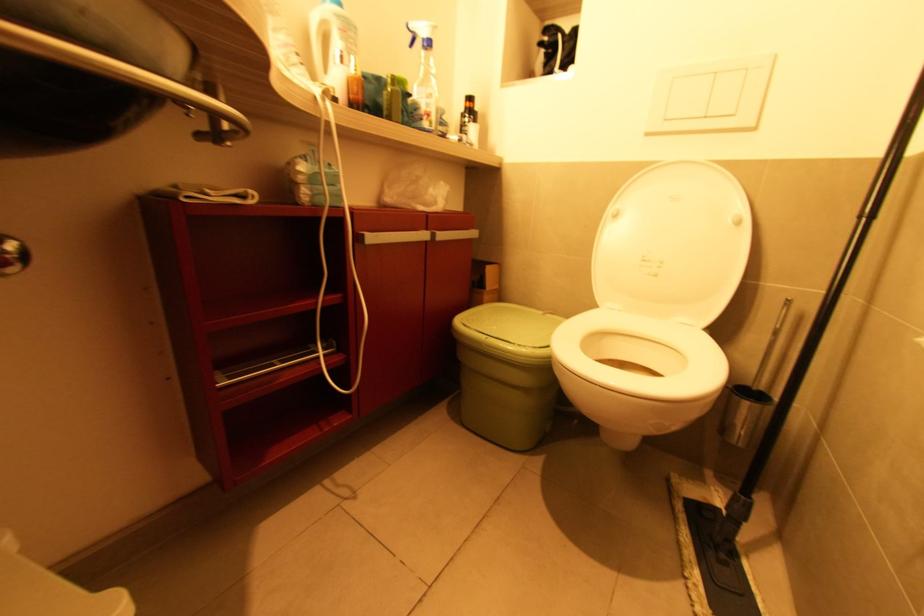
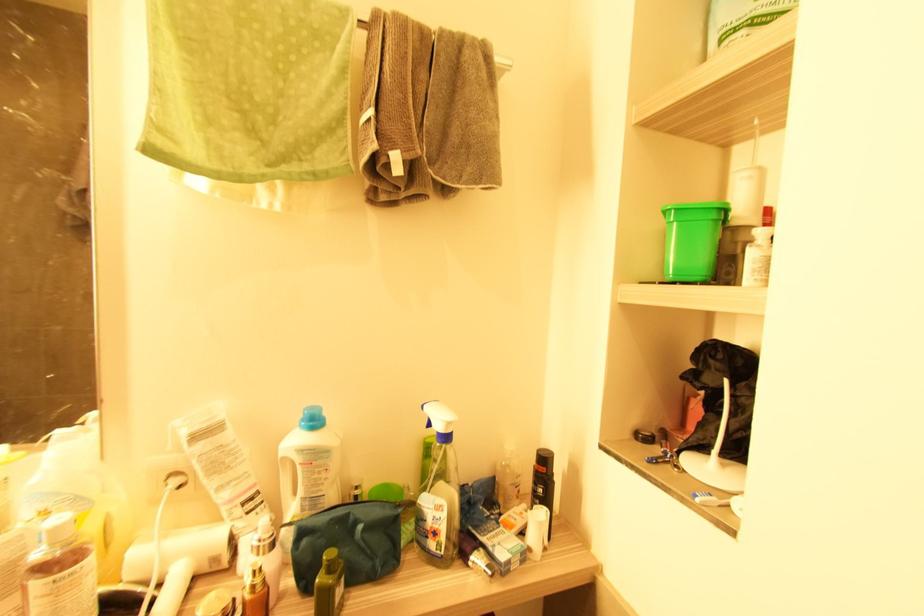
Where in the second image is the point corresponding to point (424, 121) from the first image?

(429, 539)